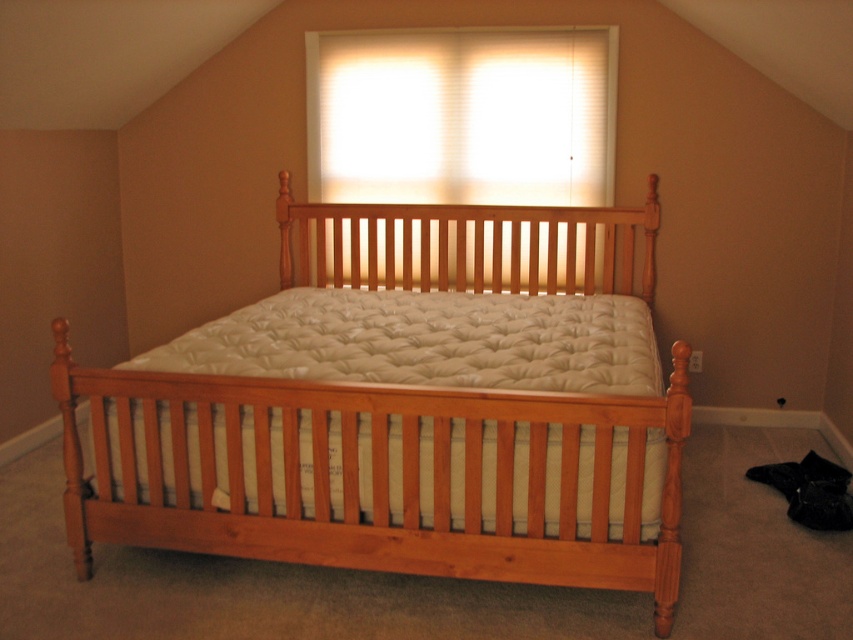
Question: Can you confirm if white quilted mattress at center is smaller than white blinds at upper center?

Choices:
 (A) no
 (B) yes

Answer: (A)

Question: Does white quilted mattress at center lie in front of white blinds at upper center?

Choices:
 (A) yes
 (B) no

Answer: (A)

Question: Which of the following is the farthest from the observer?

Choices:
 (A) white quilted mattress at center
 (B) natural wood bed at center
 (C) white blinds at upper center

Answer: (C)

Question: Which point is closer to the camera?

Choices:
 (A) natural wood bed at center
 (B) white blinds at upper center
 (C) white quilted mattress at center

Answer: (A)

Question: Which point appears farthest from the camera in this image?

Choices:
 (A) (164, 500)
 (B) (563, 476)
 (C) (403, 76)

Answer: (C)

Question: Does white quilted mattress at center appear under white blinds at upper center?

Choices:
 (A) no
 (B) yes

Answer: (B)